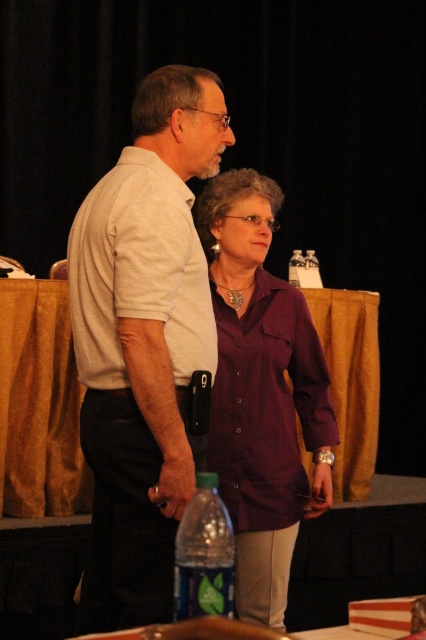
Question: Which object is the closest to the green plastic bottle at lower center?

Choices:
 (A) clear plastic bottle at center
 (B) white matte shirt at center
 (C) white cotton shirt at center

Answer: (B)

Question: Estimate the real-world distances between objects in this image. Which object is farther from the clear plastic bottle at center?

Choices:
 (A) green plastic bottle at lower center
 (B) white matte shirt at center
 (C) purple cotton shirt at center

Answer: (A)

Question: Does purple cotton shirt at center appear on the left side of white cotton shirt at center?

Choices:
 (A) yes
 (B) no

Answer: (B)

Question: Which object is the closest to the white cotton shirt at center?

Choices:
 (A) clear plastic bottle at center
 (B) white matte shirt at center
 (C) purple cotton shirt at center
 (D) green plastic bottle at lower center

Answer: (B)

Question: Is purple cotton shirt at center closer to camera compared to white cotton shirt at center?

Choices:
 (A) yes
 (B) no

Answer: (B)

Question: Does white matte shirt at center appear over purple cotton shirt at center?

Choices:
 (A) no
 (B) yes

Answer: (B)